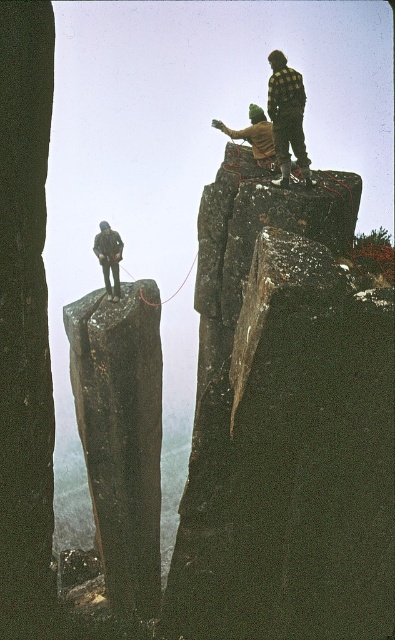
Which is in front, point (276, 116) or point (114, 282)?

Point (276, 116)

Which is above, checkered flannel shirt at upper right or camouflage jacket at left?

checkered flannel shirt at upper right is higher up.

Which is in front, point (289, 128) or point (107, 243)?

Point (289, 128)

I want to click on checkered flannel shirt at upper right, so click(x=287, y=116).